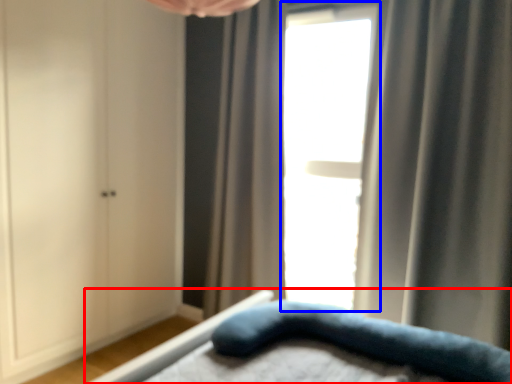
Question: Which object appears closest to the camera in this image, bed (highlighted by a red box) or window (highlighted by a blue box)?

Choices:
 (A) bed
 (B) window

Answer: (A)